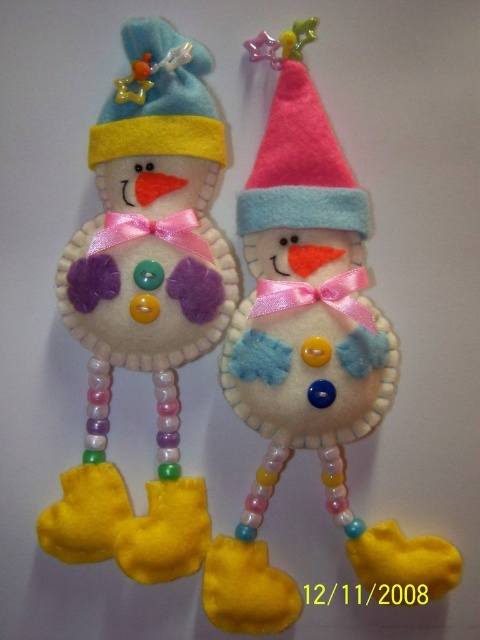
Question: Which point is farther to the camera?

Choices:
 (A) felt snowman at center
 (B) felt snowman at left

Answer: (B)

Question: Can you confirm if felt snowman at center is wider than felt snowman at left?

Choices:
 (A) yes
 (B) no

Answer: (A)

Question: Observing the image, what is the correct spatial positioning of felt snowman at center in reference to felt snowman at left?

Choices:
 (A) left
 (B) right

Answer: (B)

Question: Among these objects, which one is farthest from the camera?

Choices:
 (A) felt snowman at center
 (B) felt snowman at left

Answer: (B)

Question: From the image, what is the correct spatial relationship of felt snowman at center in relation to felt snowman at left?

Choices:
 (A) above
 (B) below

Answer: (B)